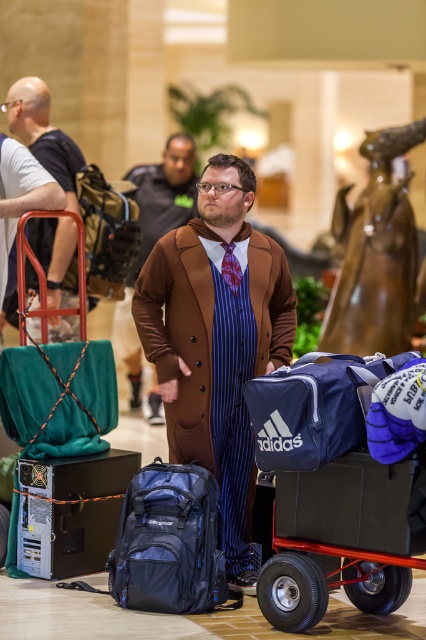
Question: Observing the image, what is the correct spatial positioning of blue fabric cart at center in reference to patterned silk tie at center?

Choices:
 (A) right
 (B) left

Answer: (A)

Question: From the image, what is the correct spatial relationship of blue fabric backpack at center in relation to patterned silk tie at center?

Choices:
 (A) below
 (B) above

Answer: (A)

Question: Observing the image, what is the correct spatial positioning of blue fabric backpack at center in reference to patterned silk tie at center?

Choices:
 (A) below
 (B) above

Answer: (A)

Question: Among these objects, which one is nearest to the camera?

Choices:
 (A) brown wool coat at center
 (B) camouflage fabric backpack at center
 (C) bald man at left

Answer: (A)

Question: Which object is positioned closest to the brown wool coat at center?

Choices:
 (A) patterned silk tie at center
 (B) brown leather coat at center

Answer: (A)

Question: Estimate the real-world distances between objects in this image. Which object is farther from the blue fabric cart at center?

Choices:
 (A) bald man at left
 (B) brown wool coat at center
 (C) blue fabric backpack at center
 (D) camouflage fabric backpack at center

Answer: (D)